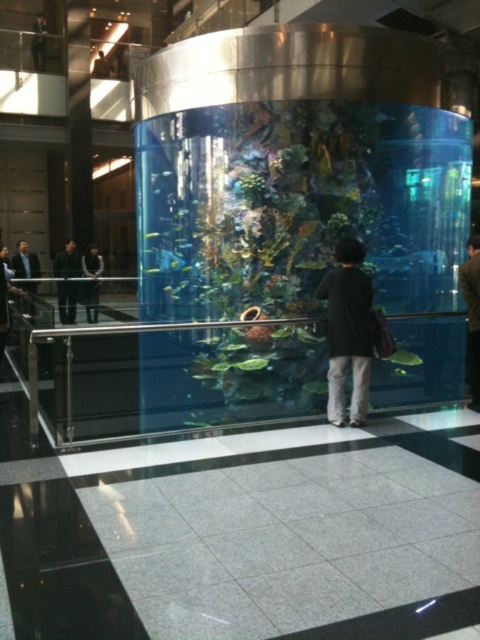
Question: Among these points, which one is farthest from the camera?

Choices:
 (A) (52, 268)
 (B) (345, 339)
 (C) (467, 336)
 (D) (25, 252)

Answer: (D)

Question: Which point appears closest to the camera in this image?

Choices:
 (A) (476, 248)
 (B) (339, 358)

Answer: (B)

Question: Is dark brown leather jacket at right above dark gray suit at left?

Choices:
 (A) yes
 (B) no

Answer: (B)

Question: Estimate the real-world distances between objects in this image. Which object is closer to the dark gray suit at left?

Choices:
 (A) black matte jacket at center
 (B) matte black jacket at upper left
 (C) dark brown leather jacket at right
 (D) black matte suit at left

Answer: (D)

Question: Does black matte suit at left appear under matte black jacket at upper left?

Choices:
 (A) no
 (B) yes

Answer: (B)

Question: In this image, where is black matte jacket at center located relative to matte black jacket at upper left?

Choices:
 (A) left
 (B) right

Answer: (B)